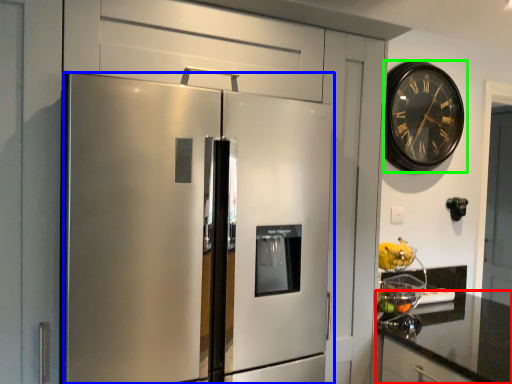
Question: Considering the real-world distances, which object is farthest from countertop (highlighted by a red box)? refrigerator (highlighted by a blue box) or wall clock (highlighted by a green box)?

Choices:
 (A) refrigerator
 (B) wall clock

Answer: (B)